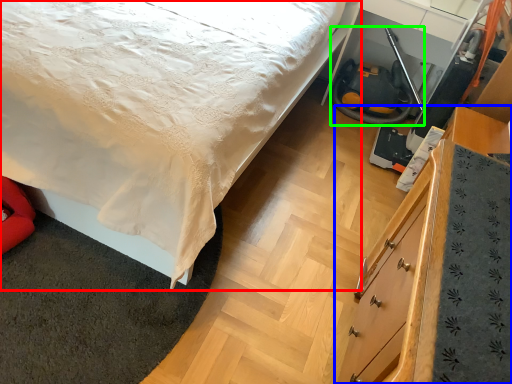
Question: Estimate the real-world distances between objects in this image. Which object is closer to bed (highlighted by a red box), chest of drawers (highlighted by a blue box) or fire hose (highlighted by a green box)?

Choices:
 (A) chest of drawers
 (B) fire hose

Answer: (A)